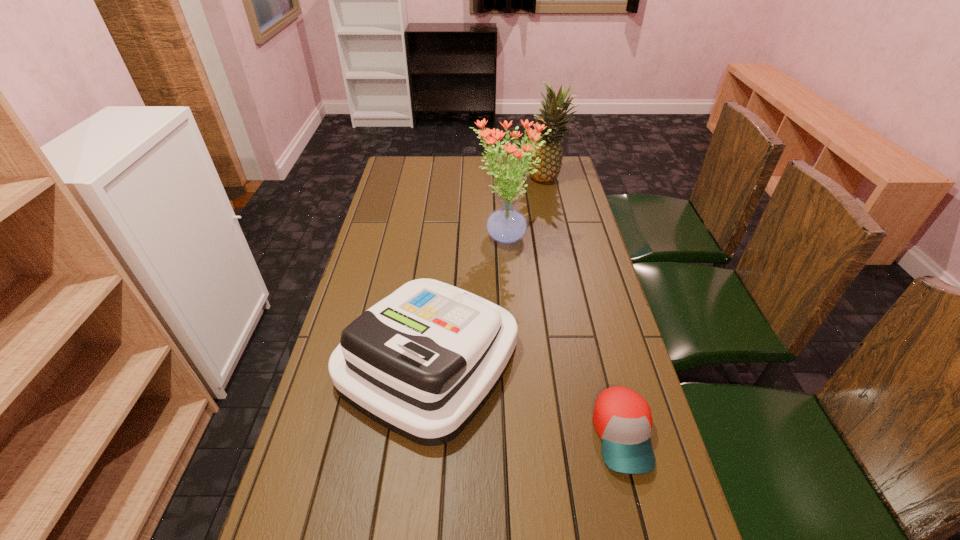
Find the location of `free spot between the shortest object and the farthest object`. free spot between the shortest object and the farthest object is located at coordinates (586, 307).

Identify the location of empty space that is in between the cash register and the shortest object. (526, 397).

At what (x,y) coordinates should I click in order to perform the action: click on empty space that is in between the shortest object and the flower arrangement. Please return your answer as a coordinate pair (x, y). This screenshot has height=540, width=960. Looking at the image, I should click on (564, 338).

Where is `free space that is in between the cash register and the baseball cap`? free space that is in between the cash register and the baseball cap is located at coordinates (526, 397).

Where is `unoccupied position between the third tallest object and the shortest object`? This screenshot has width=960, height=540. unoccupied position between the third tallest object and the shortest object is located at coordinates [526, 397].

Where is `vacant region between the flower arrangement and the shortest object`? Image resolution: width=960 pixels, height=540 pixels. vacant region between the flower arrangement and the shortest object is located at coordinates (564, 338).

You are a GUI agent. You are given a task and a screenshot of the screen. Output one action in this format:
    pyautogui.click(x=<x>, y=<y>)
    Task: Click on the object that is the nearest to the second farthest object
    This screenshot has height=540, width=960.
    Given the screenshot: What is the action you would take?
    pyautogui.click(x=422, y=362)

Locate which object ranks in proximity to the flower arrangement. Please provide its 2D coordinates. Your answer should be formatted as a tuple, i.e. [(x, y)], where the tuple contains the x and y coordinates of a point satisfying the conditions above.

[(422, 362)]